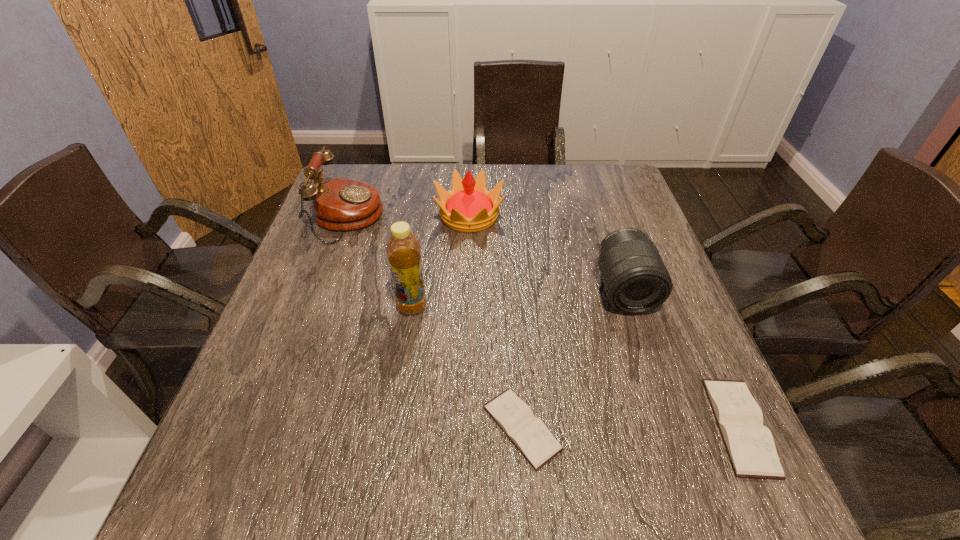
Where is `vacant space that satisfies the following two spatial constraints: 1. on the surface of the right diary; 2. on the right side of the telephoto lens`? vacant space that satisfies the following two spatial constraints: 1. on the surface of the right diary; 2. on the right side of the telephoto lens is located at coordinates (670, 426).

The image size is (960, 540). Find the location of `vacant space that satisfies the following two spatial constraints: 1. on the back side of the bottle; 2. on the dial of the leftmost object`. vacant space that satisfies the following two spatial constraints: 1. on the back side of the bottle; 2. on the dial of the leftmost object is located at coordinates (425, 218).

Where is `free spot that satisfies the following two spatial constraints: 1. on the surface of the telephoto lens; 2. on the left side of the taller diary`? free spot that satisfies the following two spatial constraints: 1. on the surface of the telephoto lens; 2. on the left side of the taller diary is located at coordinates (670, 426).

What are the coordinates of `vacant space that satisfies the following two spatial constraints: 1. on the dial of the telephone; 2. on the left side of the shorter diary` in the screenshot? It's located at (273, 428).

At what (x,y) coordinates should I click in order to perform the action: click on blank space that satisfies the following two spatial constraints: 1. on the front side of the crown; 2. on the dial of the telephone. Please return your answer as a coordinate pair (x, y). Looking at the image, I should click on (469, 218).

The image size is (960, 540). Identify the location of free location that satisfies the following two spatial constraints: 1. on the surface of the fifth tallest object; 2. on the right side of the telephoto lens. (670, 426).